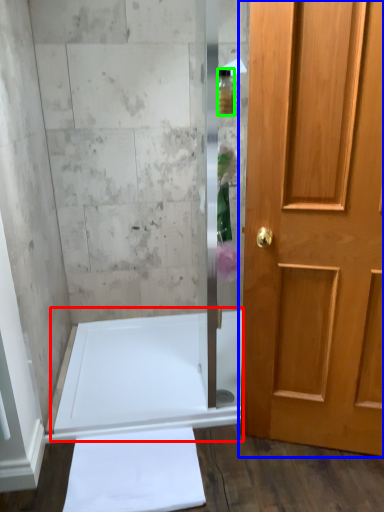
Question: Estimate the real-world distances between objects in this image. Which object is closer to bath (highlighted by a red box), door (highlighted by a blue box) or toiletry (highlighted by a green box)?

Choices:
 (A) door
 (B) toiletry

Answer: (A)